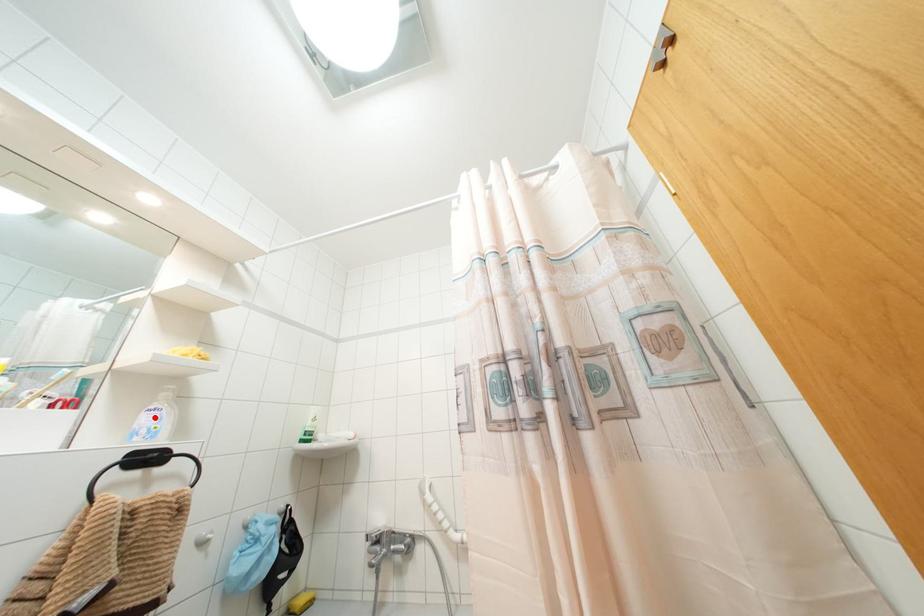
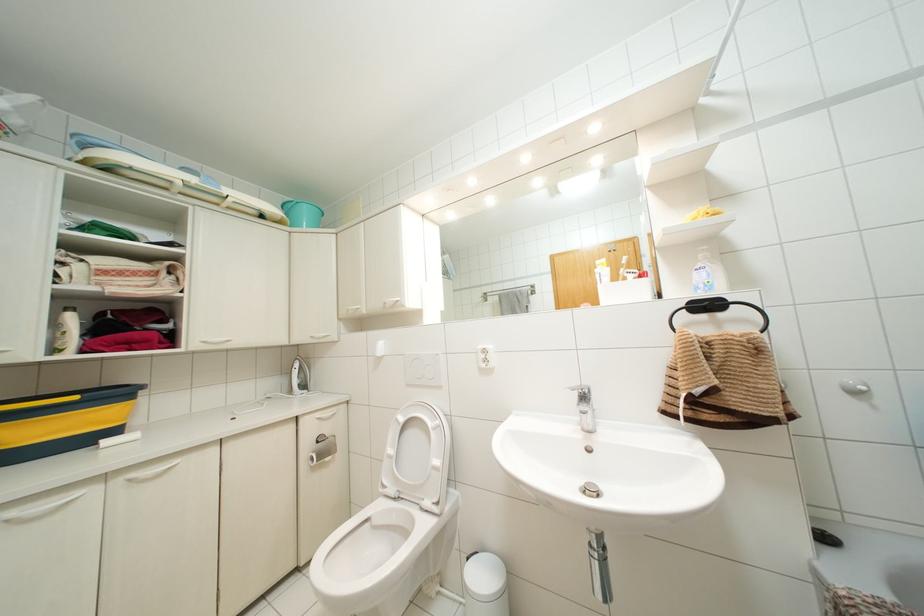
In the second image, find the point that corresponds to the highlighted location in the first image.

(703, 274)